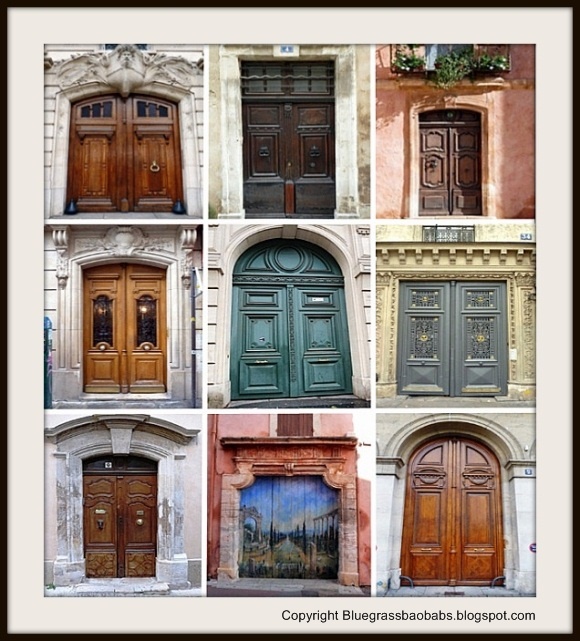
Locate an element on the screen. The image size is (580, 641). photos with wood doors no paint is located at coordinates (128, 500), (126, 318), (128, 168), (297, 156), (459, 500), (453, 170).